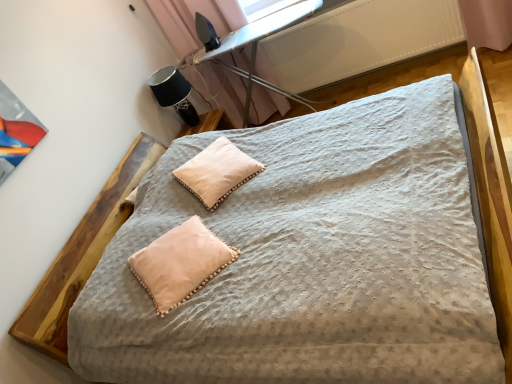
Question: Is metal ironing board at upper center closer to camera compared to black fabric table lamp at upper left?

Choices:
 (A) no
 (B) yes

Answer: (B)

Question: From the image's perspective, is metal ironing board at upper center below black fabric table lamp at upper left?

Choices:
 (A) no
 (B) yes

Answer: (A)

Question: Can you confirm if metal ironing board at upper center is bigger than black fabric table lamp at upper left?

Choices:
 (A) yes
 (B) no

Answer: (A)

Question: Is metal ironing board at upper center surrounding black fabric table lamp at upper left?

Choices:
 (A) no
 (B) yes

Answer: (A)

Question: Is metal ironing board at upper center taller than black fabric table lamp at upper left?

Choices:
 (A) yes
 (B) no

Answer: (A)

Question: Visually, is peach velvet pillow at lower left, which is the 2th pillow from top to bottom, positioned to the left or to the right of black fabric table lamp at upper left?

Choices:
 (A) right
 (B) left

Answer: (A)

Question: Would you say peach velvet pillow at lower left, which is the 2th pillow from top to bottom, is inside or outside black fabric table lamp at upper left?

Choices:
 (A) outside
 (B) inside

Answer: (A)

Question: Does point (156, 253) appear closer or farther from the camera than point (193, 119)?

Choices:
 (A) farther
 (B) closer

Answer: (B)

Question: From the image's perspective, is peach velvet pillow at lower left, which is the 2th pillow from top to bottom, located above or below black fabric table lamp at upper left?

Choices:
 (A) below
 (B) above

Answer: (A)

Question: From their relative heights in the image, would you say white textured radiator at upper right is taller or shorter than metal ironing board at upper center?

Choices:
 (A) tall
 (B) short

Answer: (B)

Question: Choose the correct answer: Is white textured radiator at upper right inside metal ironing board at upper center or outside it?

Choices:
 (A) outside
 (B) inside

Answer: (A)

Question: From the image's perspective, relative to metal ironing board at upper center, is white textured radiator at upper right above or below?

Choices:
 (A) above
 (B) below

Answer: (A)

Question: Looking at the image, does white textured radiator at upper right seem bigger or smaller compared to metal ironing board at upper center?

Choices:
 (A) big
 (B) small

Answer: (B)

Question: Is peach velvet pillow at lower left, the 2th pillow from the back, bigger or smaller than white soft pillow at center, which is counted as the second pillow, starting from the front?

Choices:
 (A) small
 (B) big

Answer: (A)

Question: From their relative heights in the image, would you say peach velvet pillow at lower left, which is the 2th pillow from top to bottom, is taller or shorter than white soft pillow at center, the 1th pillow from the top?

Choices:
 (A) tall
 (B) short

Answer: (B)